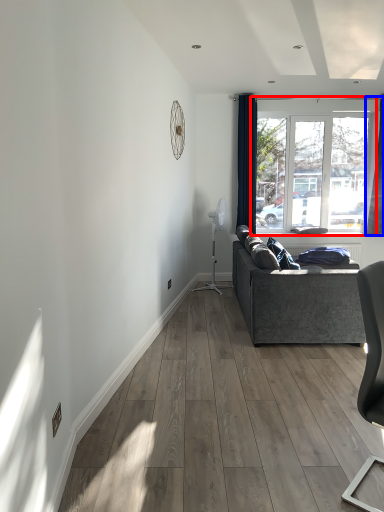
Question: Among these objects, which one is nearest to the camera, window (highlighted by a red box) or curtain (highlighted by a blue box)?

Choices:
 (A) window
 (B) curtain

Answer: (B)